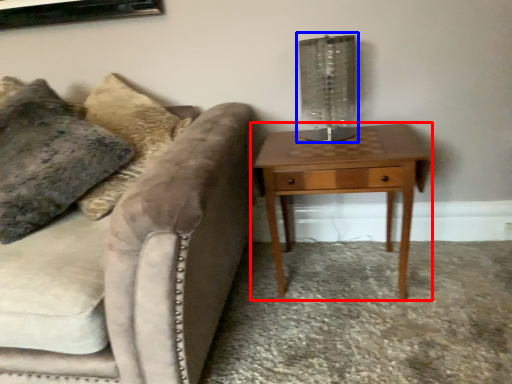
Question: Which point is further to the camera, nightstand (highlighted by a red box) or table lamp (highlighted by a blue box)?

Choices:
 (A) nightstand
 (B) table lamp

Answer: (B)